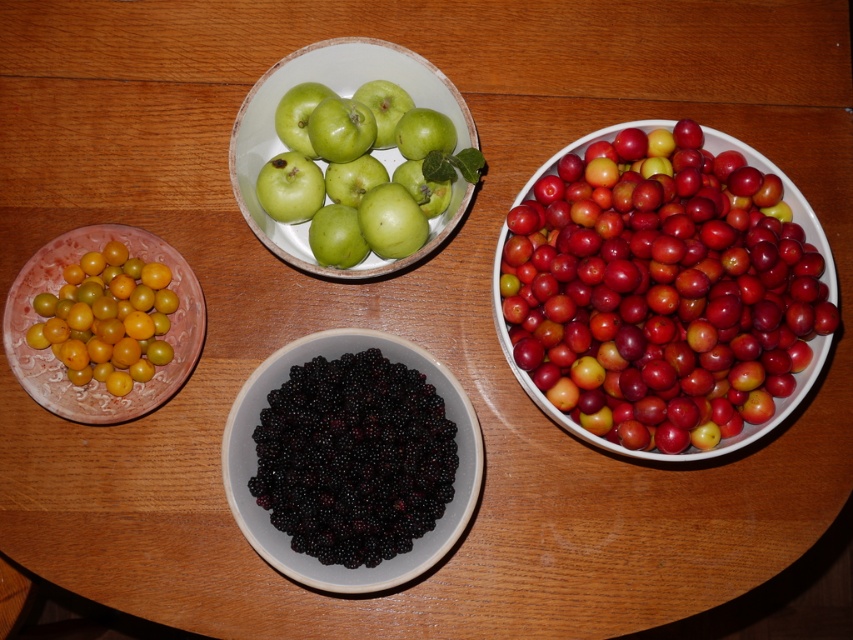
Question: Where is glossy red cherry at right located in relation to black matte/blackberry at center in the image?

Choices:
 (A) above
 (B) below

Answer: (A)

Question: Considering the real-world distances, which object is closest to the glossy red cherry at right?

Choices:
 (A) yellow matte cherry at lower left
 (B) green matte apples at center
 (C) black matte/blackberry at center

Answer: (C)

Question: Does glossy red cherry at right have a lesser width compared to green matte apples at center?

Choices:
 (A) no
 (B) yes

Answer: (A)

Question: Which object is the closest to the yellow matte cherry at lower left?

Choices:
 (A) green matte apples at center
 (B) black matte/blackberry at center

Answer: (A)

Question: Which point is farther to the camera?

Choices:
 (A) (257, 520)
 (B) (611, 404)

Answer: (B)

Question: Does glossy red cherry at right appear on the right side of green matte apples at center?

Choices:
 (A) yes
 (B) no

Answer: (A)